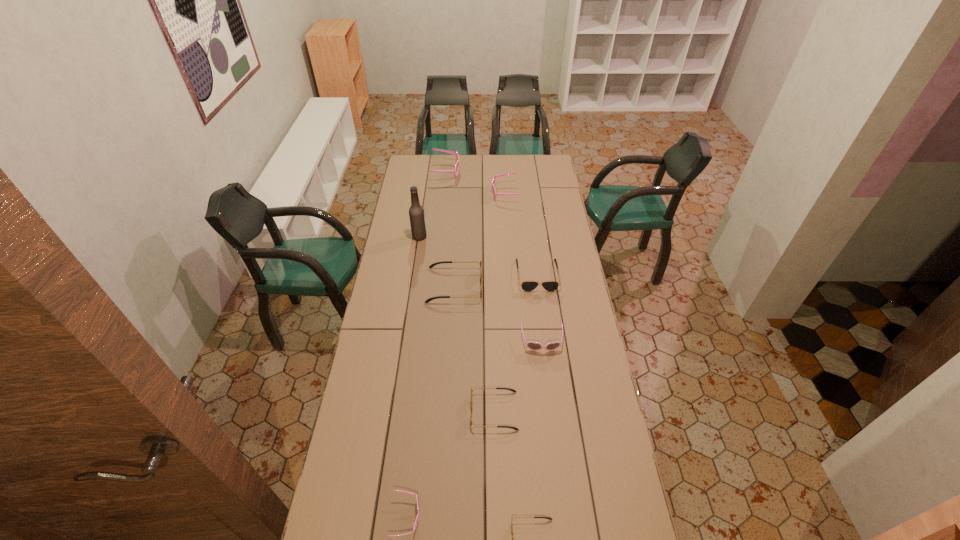
This screenshot has height=540, width=960. What are the coordinates of `vacant space located on the front-facing side of the second nearest black sunglasses` in the screenshot? It's located at (415, 411).

Find the location of a particular element. The height and width of the screenshot is (540, 960). vacant space located on the front-facing side of the second nearest black sunglasses is located at coordinates (418, 411).

The height and width of the screenshot is (540, 960). What are the coordinates of `vacant space situated 0.320m on the front-facing side of the second nearest black sunglasses` in the screenshot? It's located at (380, 411).

Where is `object located at the far edge`? This screenshot has height=540, width=960. object located at the far edge is located at coordinates (455, 171).

Identify the location of object situated at the left edge. This screenshot has width=960, height=540. (416, 212).

Identify the location of free space at the left edge of the desktop. (378, 488).

Image resolution: width=960 pixels, height=540 pixels. What are the coordinates of `vacant space at the right edge` in the screenshot? It's located at (554, 315).

Find the location of a particular element. The image size is (960, 540). free space between the second biggest pink sunglasses and the biggest black sunglasses is located at coordinates (479, 239).

Locate an element on the screen. free spot between the tallest sunglasses and the seventh nearest object is located at coordinates (433, 204).

At what (x,y) coordinates should I click in order to perform the action: click on vacant region between the third biggest pink sunglasses and the biggest black sunglasses. Please return your answer as a coordinate pair (x, y). This screenshot has height=540, width=960. Looking at the image, I should click on (498, 314).